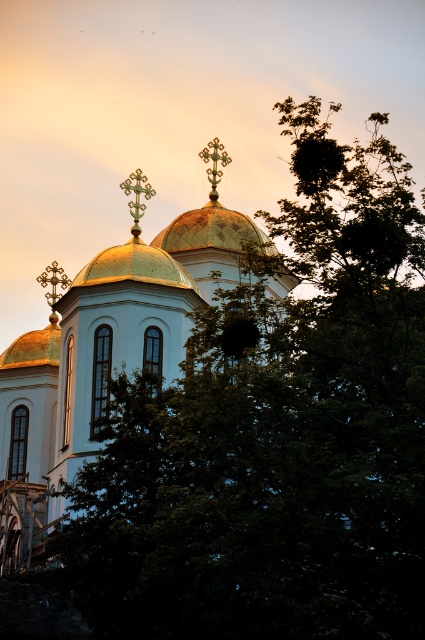
Question: Is gold domed roof at center to the right of gold polished dome at upper left from the viewer's perspective?

Choices:
 (A) no
 (B) yes

Answer: (B)

Question: Among these objects, which one is nearest to the camera?

Choices:
 (A) gold metallic cross at center
 (B) gold metallic cross at upper center
 (C) gold polished dome at upper left

Answer: (B)

Question: Among these points, which one is nearest to the camera?

Choices:
 (A) (217, 173)
 (B) (170, 260)
 (C) (235, 232)

Answer: (B)

Question: Which of the following is the closest to the observer?

Choices:
 (A) gold domed roof at center
 (B) gold polished dome at center

Answer: (B)

Question: Is gold domed church at center smaller than gold metallic cross at center?

Choices:
 (A) no
 (B) yes

Answer: (A)

Question: Considering the relative positions of gold domed church at center and gold metallic cross at center in the image provided, where is gold domed church at center located with respect to gold metallic cross at center?

Choices:
 (A) above
 (B) below

Answer: (B)